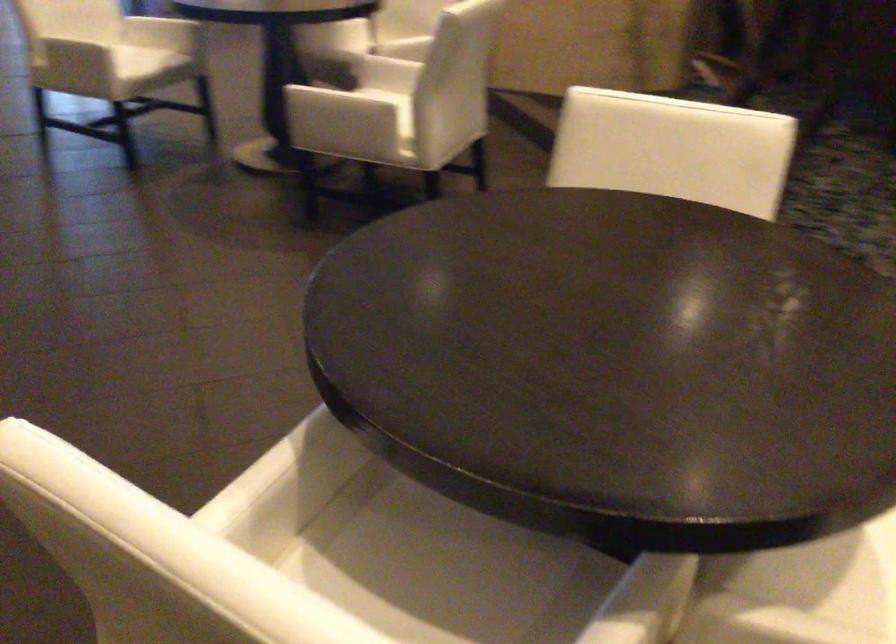
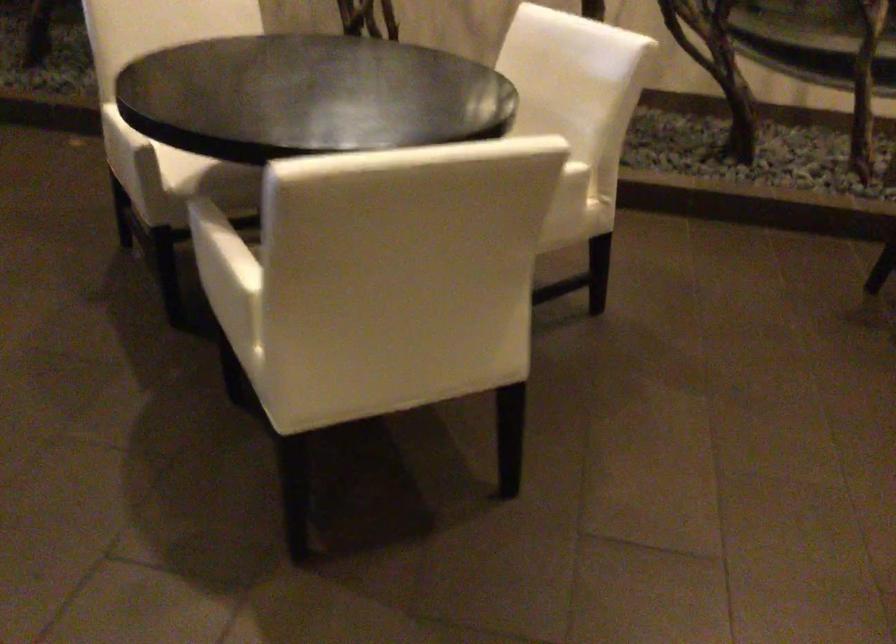
Locate, in the second image, the point that corresponds to point (248, 468) in the first image.

(220, 249)